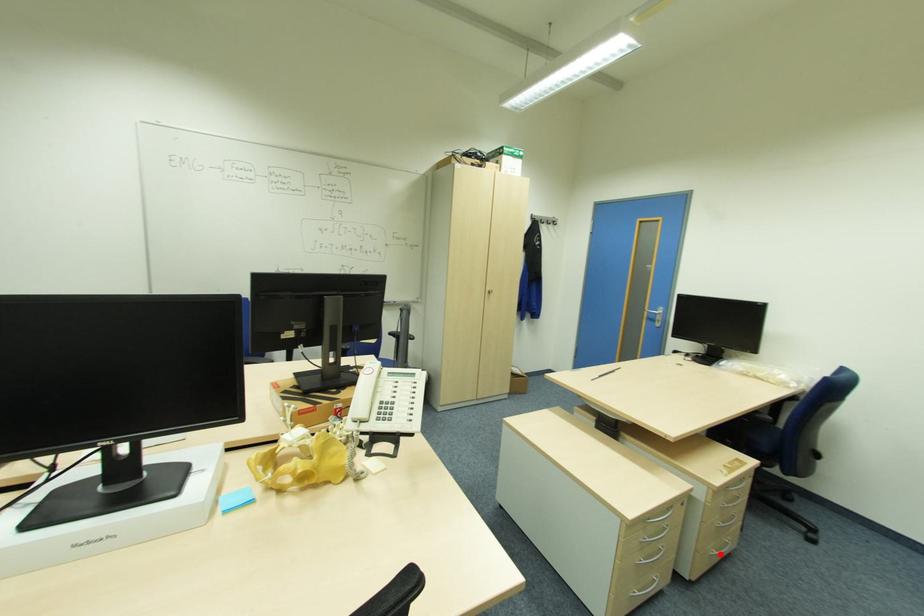
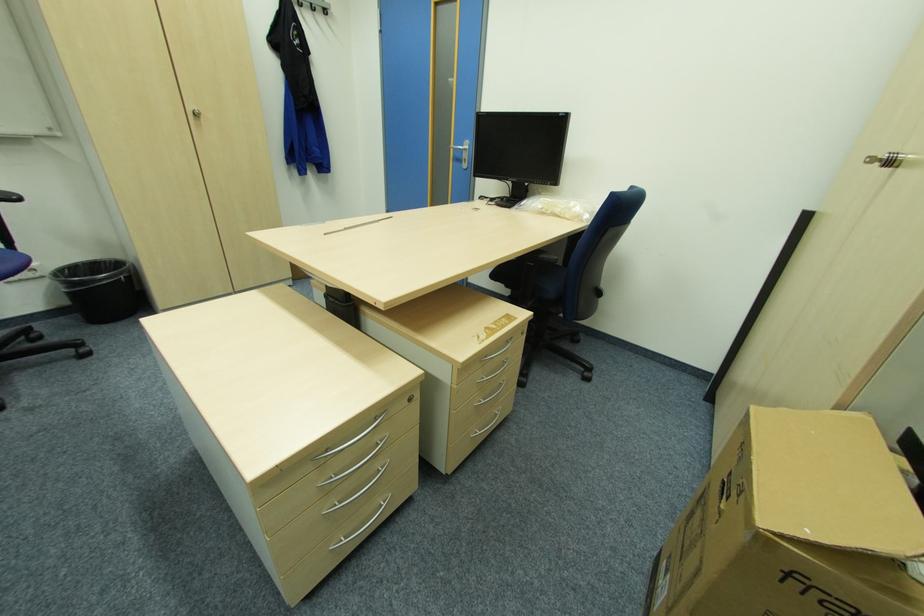
Question: I am providing you with two images of the same scene from different viewpoints. Image1 has a red point marked. In image2, the corresponding 3D location appears at what relative position? Reply with the corresponding letter.

Choices:
 (A) Closer
 (B) Farther

Answer: (B)